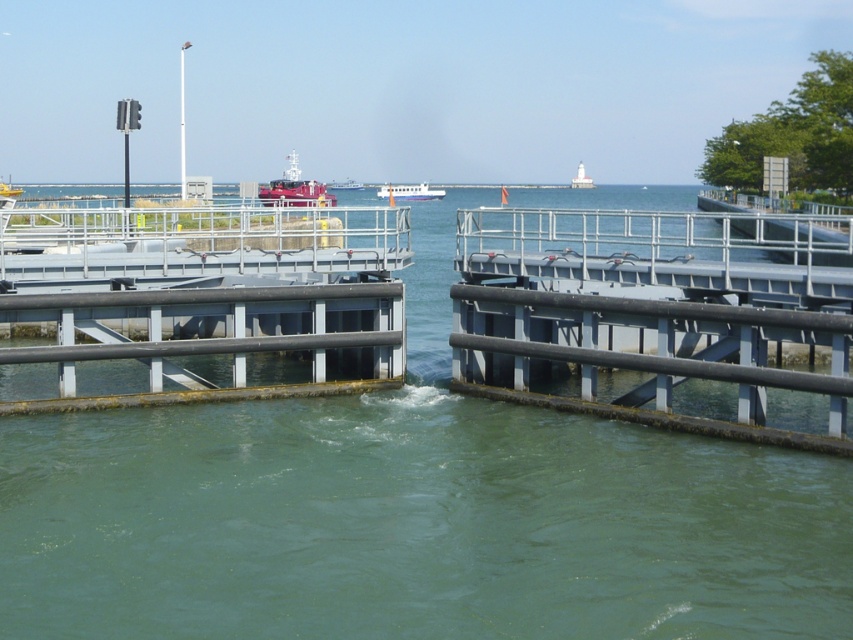
Question: Which of the following is the closest to the observer?

Choices:
 (A) (339, 186)
 (B) (579, 168)
 (C) (289, 179)
 (D) (402, 196)

Answer: (C)

Question: Which object is closer to the camera taking this photo?

Choices:
 (A) metallic gray rail at center
 (B) metallic red boat at center
 (C) white glossy boat at center

Answer: (A)

Question: In this image, where is metallic red ship at center located relative to white matte lighthouse at upper center?

Choices:
 (A) right
 (B) left

Answer: (B)

Question: Considering the relative positions of white glossy boat at center and metallic red boat at center in the image provided, where is white glossy boat at center located with respect to metallic red boat at center?

Choices:
 (A) right
 (B) left

Answer: (A)

Question: Which object is farther from the camera taking this photo?

Choices:
 (A) metallic gray rail at center
 (B) white glossy boat at center
 (C) metallic red ship at center

Answer: (B)

Question: Is clear water at center closer to camera compared to white glossy boat at center?

Choices:
 (A) no
 (B) yes

Answer: (B)